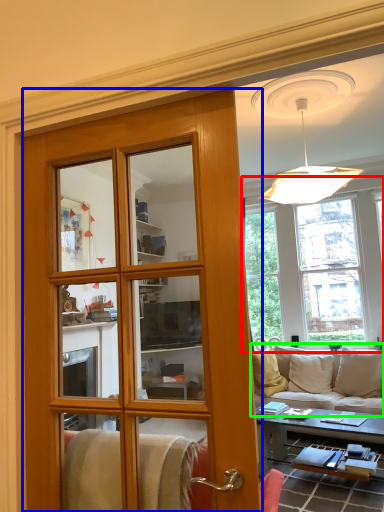
Question: Based on their relative distances, which object is nearer to window (highlighted by a red box)? Choose from door (highlighted by a blue box) and studio couch (highlighted by a green box).

Choices:
 (A) door
 (B) studio couch

Answer: (B)